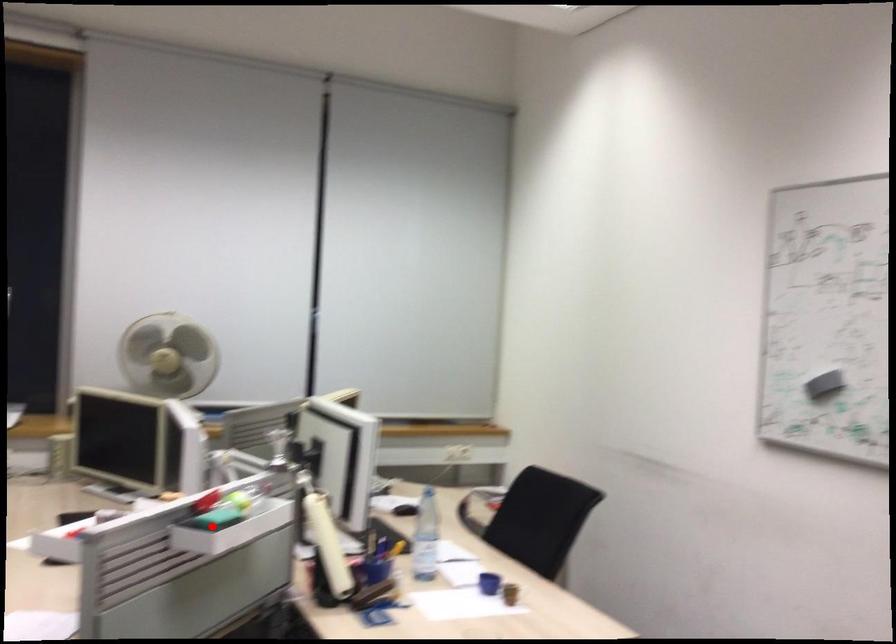
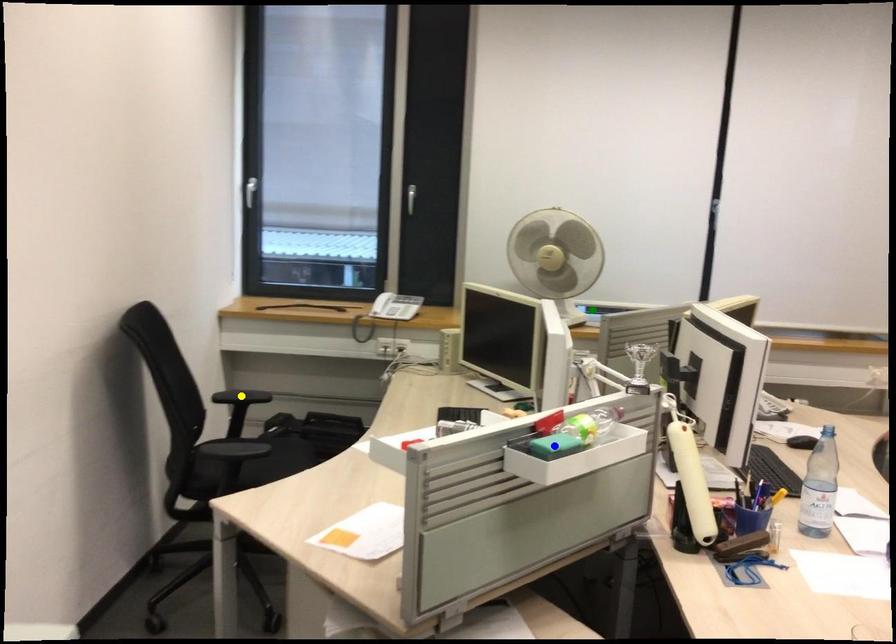
Question: I am providing you with two images of the same scene from different viewpoints. A red point is marked on the first image. You are given multiple points on the second image. Which point in image 2 is actually the same real-world point as the red point in image 1?

Choices:
 (A) green point
 (B) yellow point
 (C) blue point

Answer: (C)